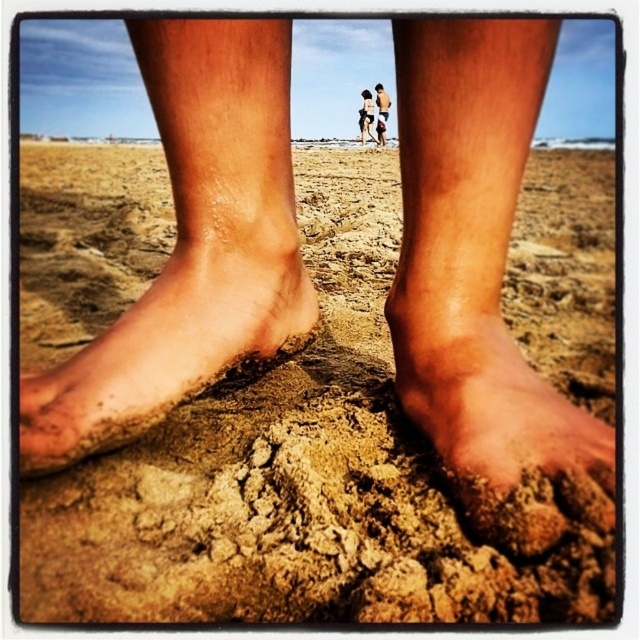
Who is positioned more to the right, dry sand at center or dusty sand foot at lower left?

From the viewer's perspective, dry sand at center appears more on the right side.

How far apart are dry sand at center and dusty sand foot at lower left?

dry sand at center and dusty sand foot at lower left are 32.59 inches apart from each other.

Between point (474, 596) and point (76, 433), which one is positioned behind?

The point (76, 433) is behind.

You are a GUI agent. You are given a task and a screenshot of the screen. Output one action in this format:
    pyautogui.click(x=<x>, y=<y>)
    Task: Click on the dry sand at center
    
    Given the screenshot: What is the action you would take?
    pyautogui.click(x=294, y=480)

Does tan skin person at center have a greater height compared to smooth tan skin at center?

In fact, tan skin person at center may be shorter than smooth tan skin at center.

Where is `tan skin person at center`? Image resolution: width=640 pixels, height=640 pixels. tan skin person at center is located at coordinates click(365, 116).

Find the location of `tan skin person at center`. tan skin person at center is located at coordinates (365, 116).

Locate an element on the screen. tan skin person at center is located at coordinates (365, 116).

Who is taller, dry sand foot at lower center or smooth tan skin at center?

smooth tan skin at center

The height and width of the screenshot is (640, 640). What are the coordinates of `dry sand foot at lower center` in the screenshot? It's located at (502, 433).

Is point (468, 385) positioned before point (378, 84)?

Yes, point (468, 385) is closer to viewer.

You are a GUI agent. You are given a task and a screenshot of the screen. Output one action in this format:
    pyautogui.click(x=<x>, y=<y>)
    Task: Click on the dry sand foot at lower center
    
    Given the screenshot: What is the action you would take?
    pyautogui.click(x=502, y=433)